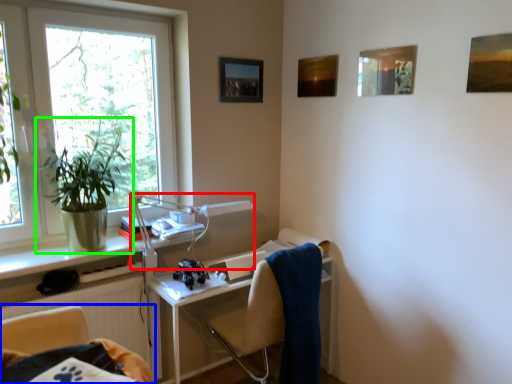
Question: Estimate the real-world distances between objects in this image. Which object is closer to equipment (highlighted by a red box), chair (highlighted by a blue box) or houseplant (highlighted by a green box)?

Choices:
 (A) chair
 (B) houseplant

Answer: (B)